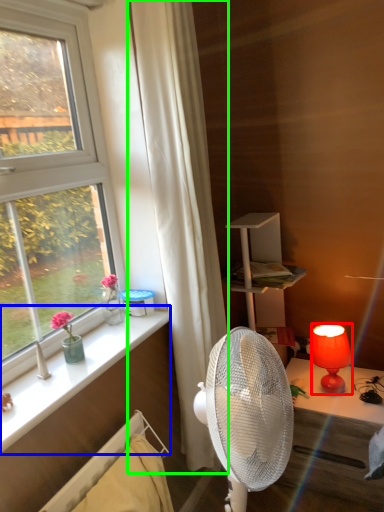
Question: Considering the real-world distances, which object is farthest from lamp (highlighted by a red box)? window sill (highlighted by a blue box) or curtain (highlighted by a green box)?

Choices:
 (A) window sill
 (B) curtain

Answer: (A)